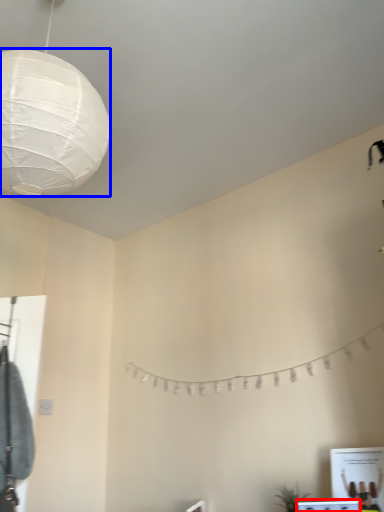
Question: Among these objects, which one is nearest to the camera, vanity (highlighted by a red box) or lantern (highlighted by a blue box)?

Choices:
 (A) vanity
 (B) lantern

Answer: (B)